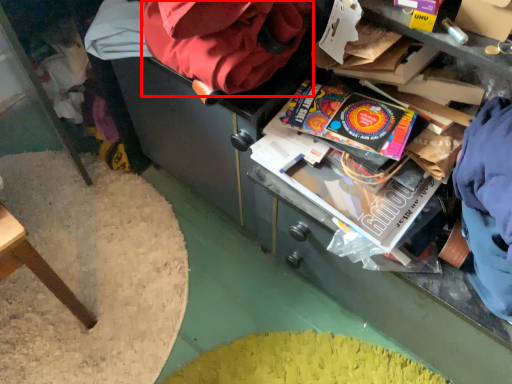
Question: Considering the relative positions of bean bag chair (annotated by the red box) and paperback book in the image provided, where is bean bag chair (annotated by the red box) located with respect to the staircase?

Choices:
 (A) left
 (B) right

Answer: (A)